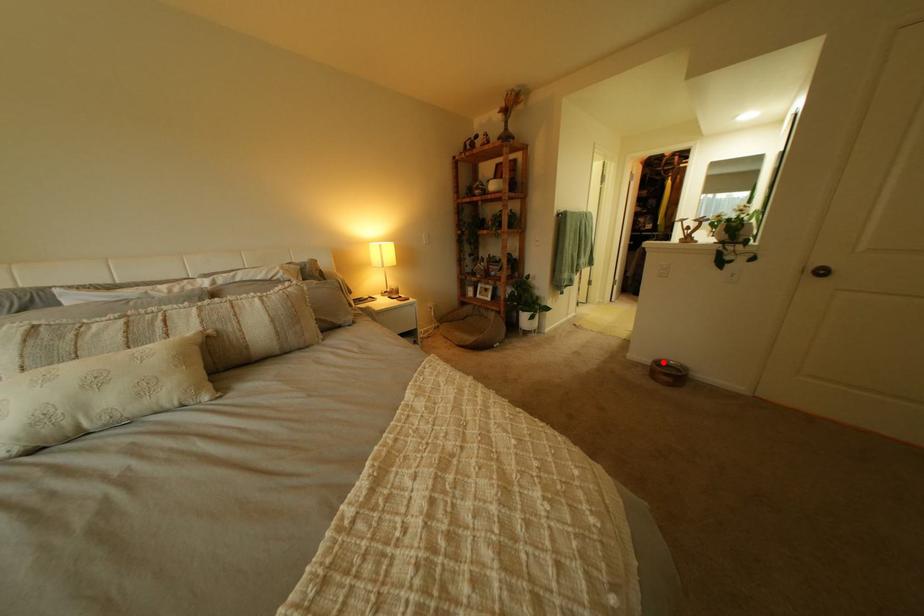
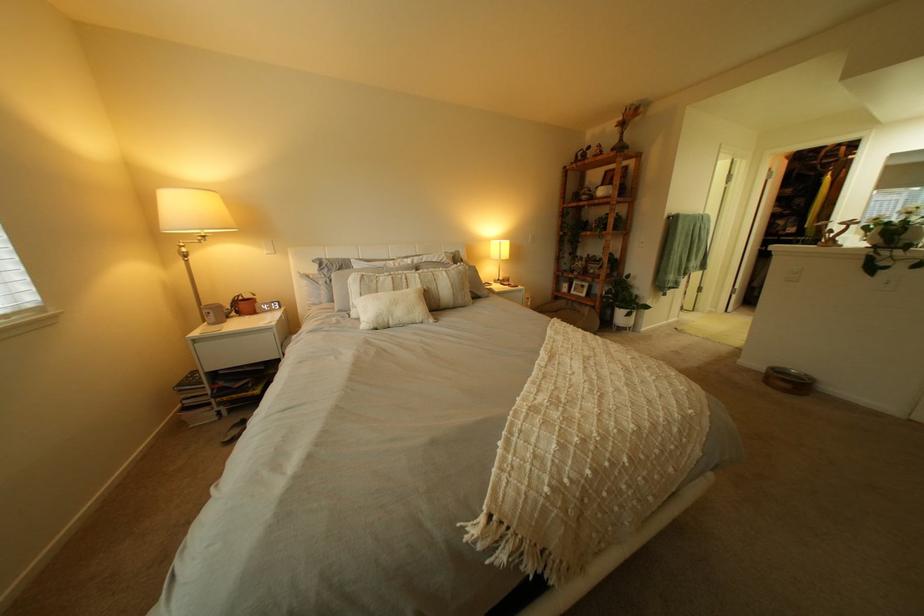
Question: A red point is marked in image1. In image2, is the corresponding 3D point closer to the camera or farther? Reply with the corresponding letter.

Choices:
 (A) The corresponding 3D point is closer.
 (B) The corresponding 3D point is farther.

Answer: (B)